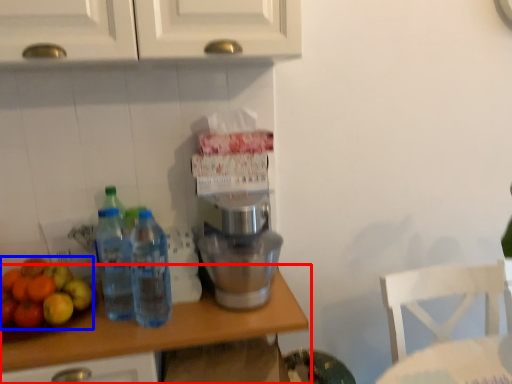
Question: Which of the following is the farthest to the observer, countertop (highlighted by a red box) or apple (highlighted by a blue box)?

Choices:
 (A) countertop
 (B) apple

Answer: (B)